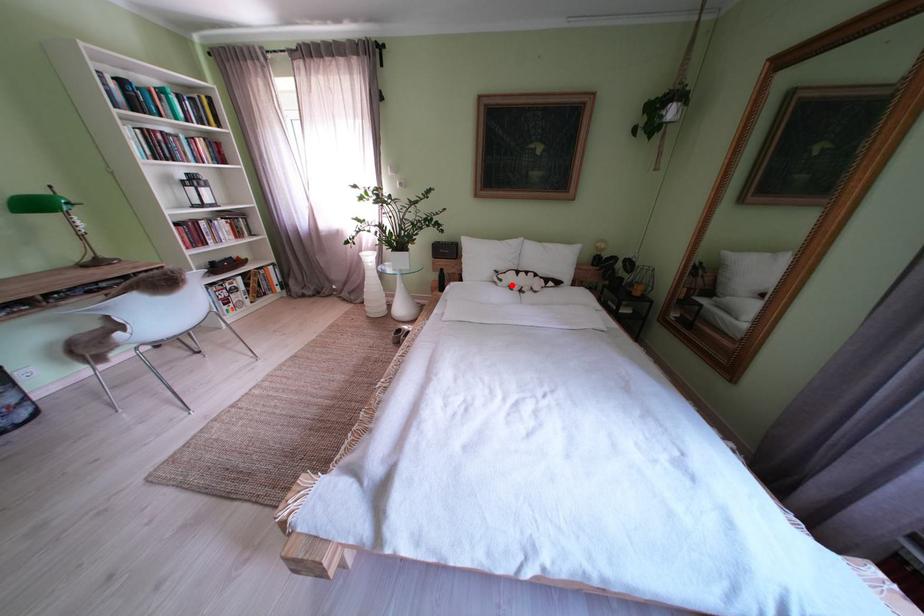
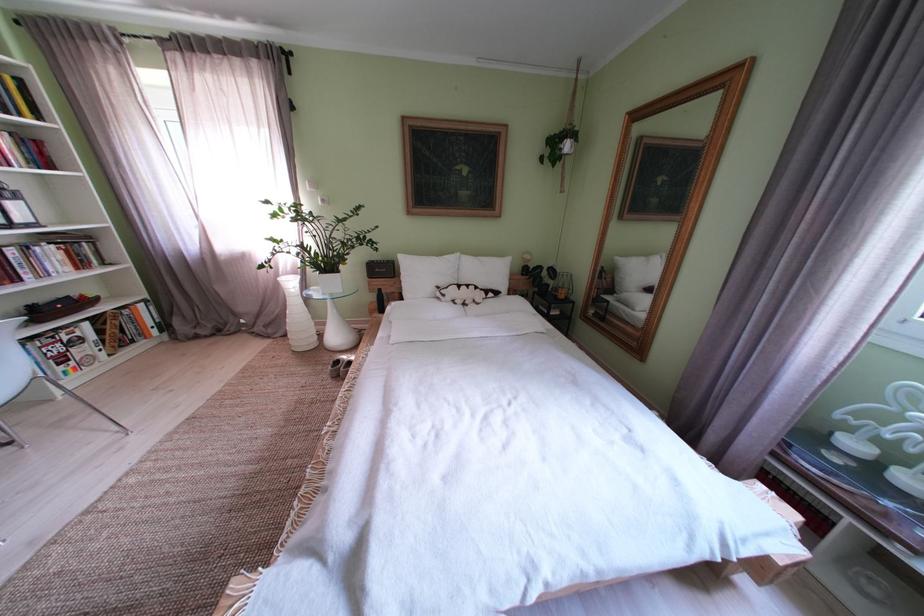
Question: I am providing you with two images of the same scene from different viewpoints. A red point is marked on the first image. Is the red point's position out of view in image 2?

Choices:
 (A) Yes
 (B) No

Answer: (B)